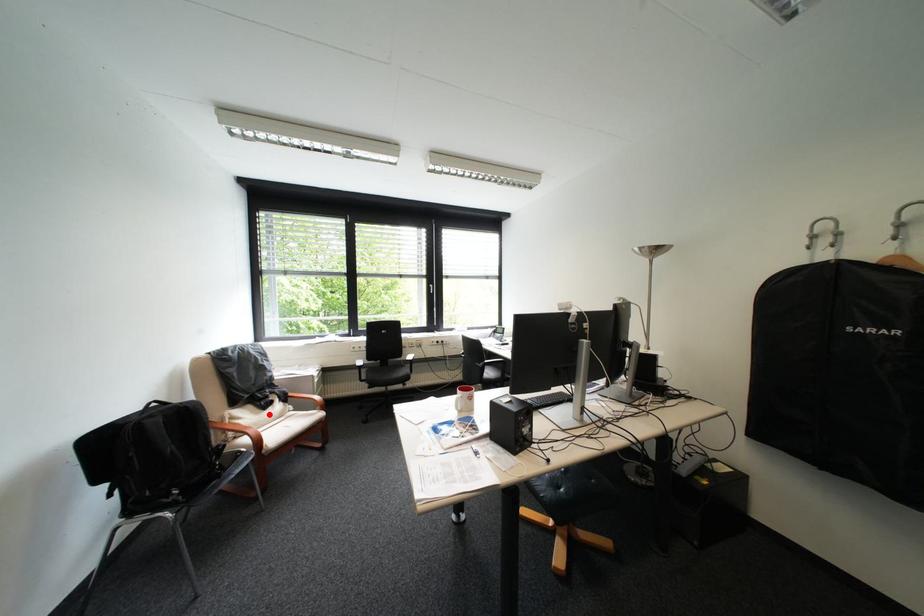
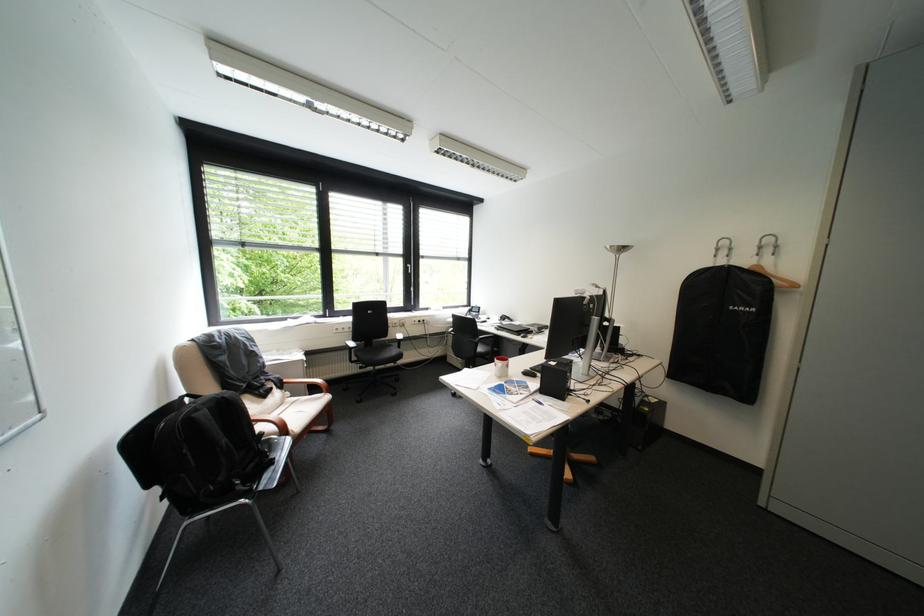
The point at the highlighted location is marked in the first image. Where is the corresponding point in the second image?

(272, 403)